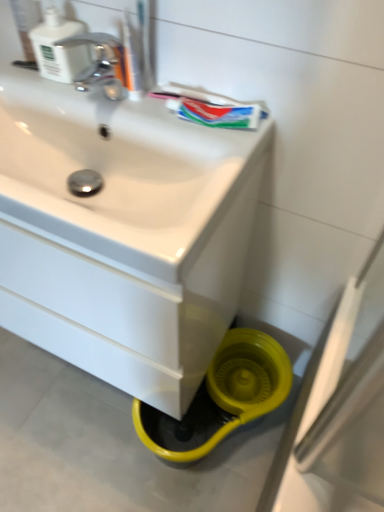
Question: Is white glossy sink at center to the right of translucent plastic toothbrush at upper center from the viewer's perspective?

Choices:
 (A) no
 (B) yes

Answer: (A)

Question: From a real-world perspective, is white glossy sink at center on translucent plastic toothbrush at upper center?

Choices:
 (A) yes
 (B) no

Answer: (B)

Question: From a real-world perspective, is white glossy sink at center below translucent plastic toothbrush at upper center?

Choices:
 (A) no
 (B) yes

Answer: (B)

Question: From the image's perspective, is white glossy sink at center located beneath translucent plastic toothbrush at upper center?

Choices:
 (A) yes
 (B) no

Answer: (A)

Question: Is white glossy sink at center directly adjacent to translucent plastic toothbrush at upper center?

Choices:
 (A) yes
 (B) no

Answer: (B)

Question: Does white glossy sink at center have a larger size compared to translucent plastic toothbrush at upper center?

Choices:
 (A) no
 (B) yes

Answer: (B)

Question: Is white plastic soap dispenser at upper left shorter than green matte toothpaste at upper center?

Choices:
 (A) yes
 (B) no

Answer: (B)

Question: Does white plastic soap dispenser at upper left touch green matte toothpaste at upper center?

Choices:
 (A) no
 (B) yes

Answer: (A)

Question: Considering the relative sizes of white plastic soap dispenser at upper left and green matte toothpaste at upper center in the image provided, is white plastic soap dispenser at upper left smaller than green matte toothpaste at upper center?

Choices:
 (A) yes
 (B) no

Answer: (B)

Question: From the image's perspective, is white plastic soap dispenser at upper left located above green matte toothpaste at upper center?

Choices:
 (A) no
 (B) yes

Answer: (B)

Question: Is white plastic soap dispenser at upper left thinner than green matte toothpaste at upper center?

Choices:
 (A) yes
 (B) no

Answer: (B)

Question: Are white plastic soap dispenser at upper left and green matte toothpaste at upper center far apart?

Choices:
 (A) yes
 (B) no

Answer: (B)

Question: Considering the relative positions of green matte toothpaste at upper center and translucent plastic toothbrush at upper center in the image provided, is green matte toothpaste at upper center behind translucent plastic toothbrush at upper center?

Choices:
 (A) no
 (B) yes

Answer: (B)